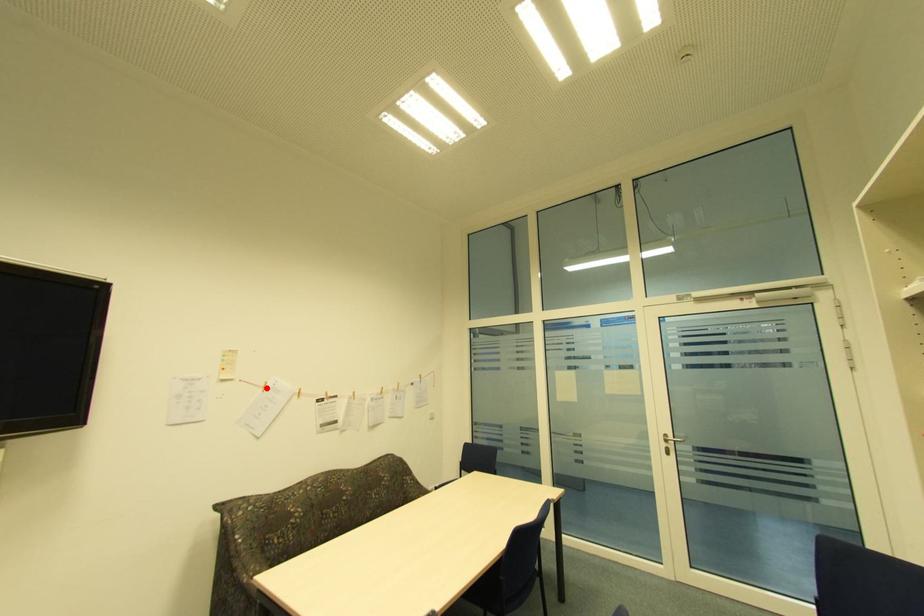
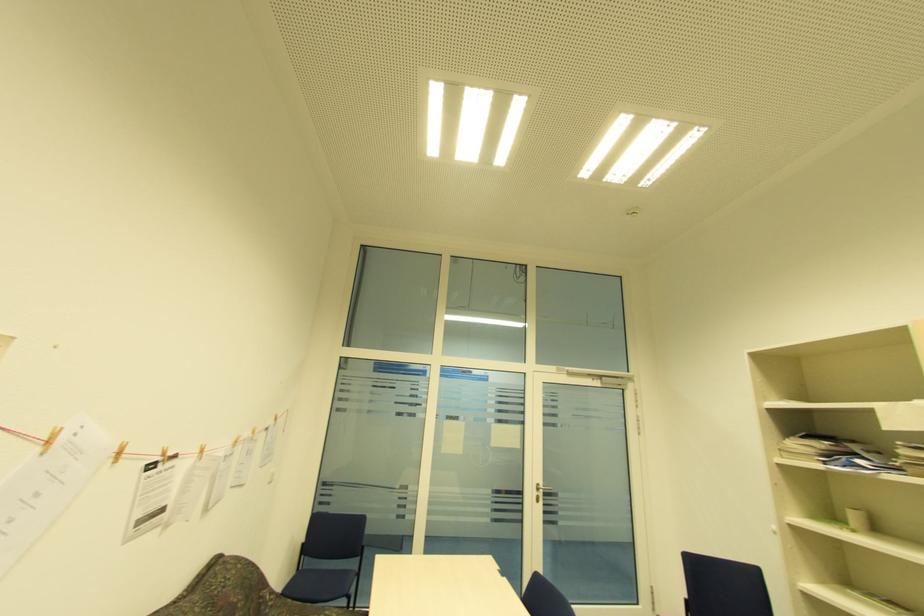
Question: I am providing you with two images of the same scene from different viewpoints. In image1, a red point is highlighted. Considering the same 3D point in image2, which of the following is correct?

Choices:
 (A) It is closer
 (B) It is farther

Answer: (A)